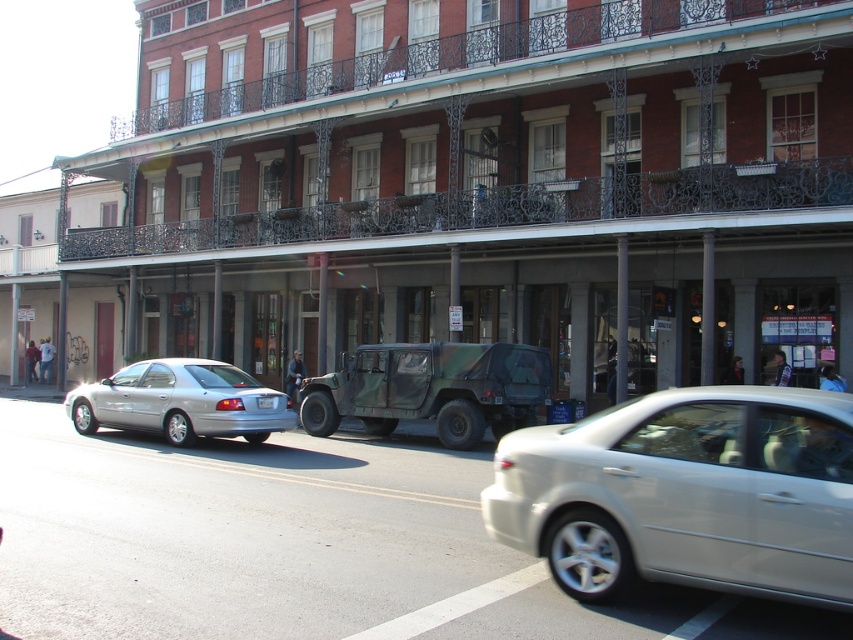
You are standing at the point with coordinates (686, 493) in the image. What object is exactly at your current location?

The silver metallic sedan at center is located at point (686, 493).